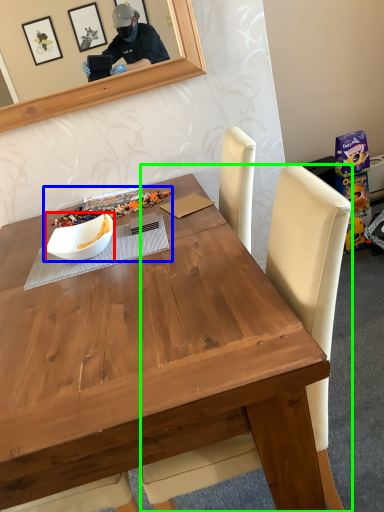
Question: Which object is the closest to the bowl (highlighted by a red box)? Choose among these: fruit dish (highlighted by a blue box) or chair (highlighted by a green box).

Choices:
 (A) fruit dish
 (B) chair

Answer: (A)